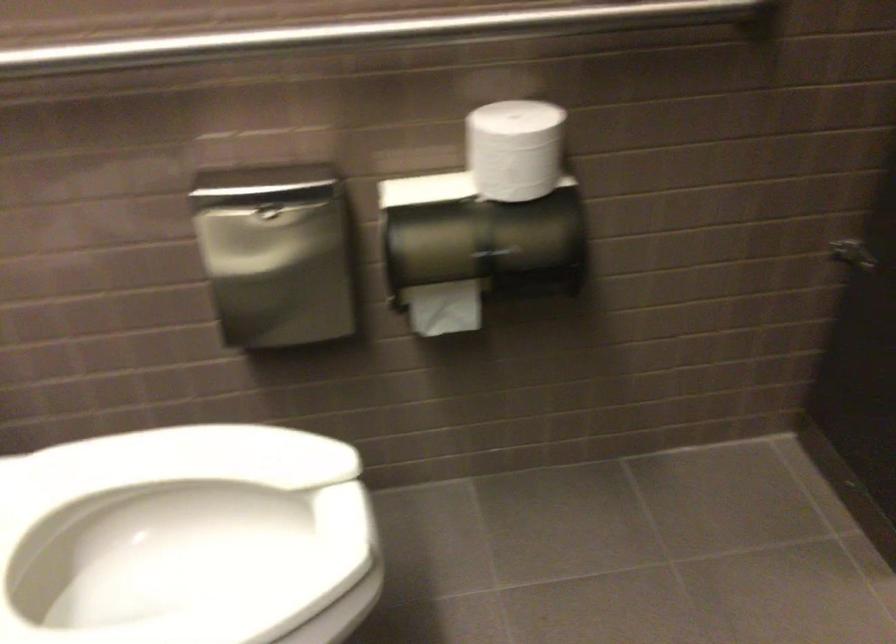
Locate an element on the screen. This screenshot has height=644, width=896. metal dispenser is located at coordinates (277, 252).